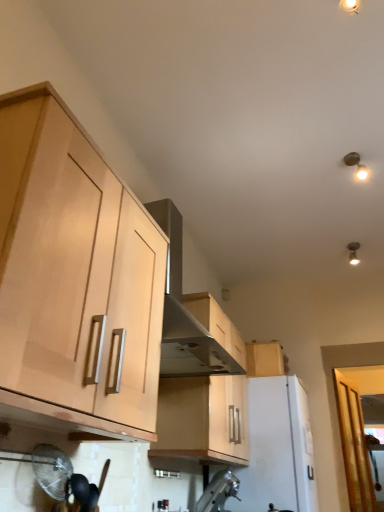
Question: Is white matte refrigerator at center, which is the 2th appliance in front-to-back order, wider or thinner than transparent glass door at lower right?

Choices:
 (A) thin
 (B) wide

Answer: (B)

Question: In terms of size, does white matte refrigerator at center, which is the 2th appliance in front-to-back order, appear bigger or smaller than transparent glass door at lower right?

Choices:
 (A) small
 (B) big

Answer: (B)

Question: Estimate the real-world distances between objects in this image. Which object is closer to the metallic ceiling light at upper right?

Choices:
 (A) stainless steel vent at upper center
 (B) transparent glass door at lower right
 (C) wooden cabinet at center, the second cabinetry when ordered from left to right
 (D) metallic silver faucet at lower center, acting as the 1th appliance starting from the front
 (E) light wood cabinet at left, the 1th cabinetry from the front

Answer: (B)

Question: Which of these objects is positioned farthest from the light wood cabinet at left, the 1th cabinetry from the front?

Choices:
 (A) light wood cabinet at upper right, placed as the third cabinetry when sorted from front to back
 (B) transparent glass door at lower right
 (C) wooden cabinet at center, the 2th cabinetry positioned from the right
 (D) metallic silver faucet at lower center, acting as the 1th appliance starting from the front
 (E) stainless steel vent at upper center

Answer: (B)